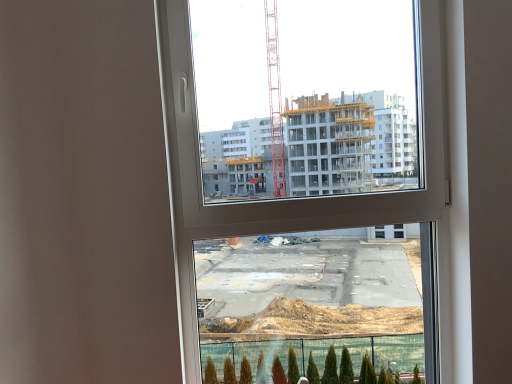
This screenshot has width=512, height=384. Describe the element at coordinates (320, 196) in the screenshot. I see `white plastic window at center` at that location.

The height and width of the screenshot is (384, 512). I want to click on white plastic window at center, so click(x=320, y=196).

Locate an element on the screen. The width and height of the screenshot is (512, 384). white plastic window at center is located at coordinates (320, 196).